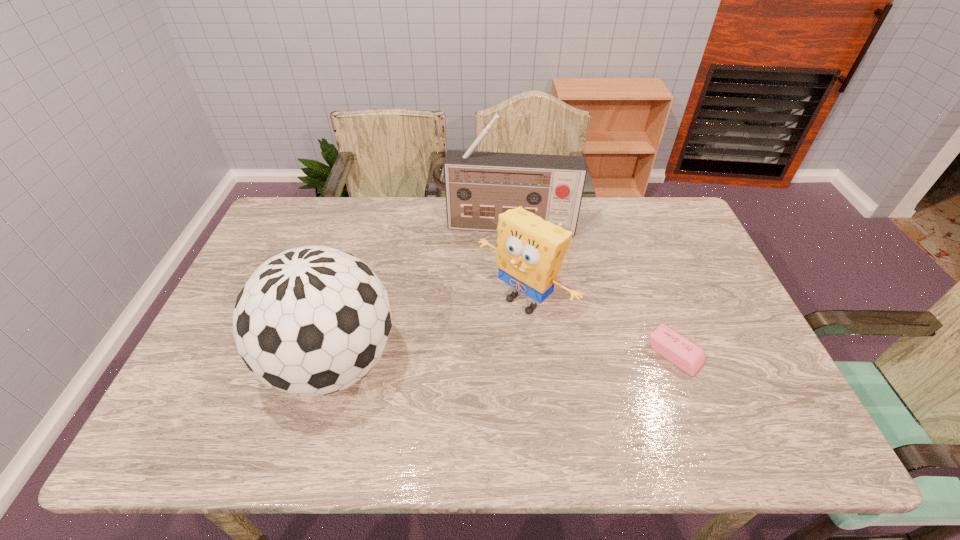
At what (x,y) coordinates should I click in order to perform the action: click on free space on the desktop that is between the leftmost object and the shortest object and is positioned on the front panel of the radio receiver. Please return your answer as a coordinate pair (x, y). Looking at the image, I should click on (494, 359).

Identify the location of vacant spot on the desktop that is between the soccer ball and the rightmost object and is positioned on the face of the sponge. Image resolution: width=960 pixels, height=540 pixels. (461, 360).